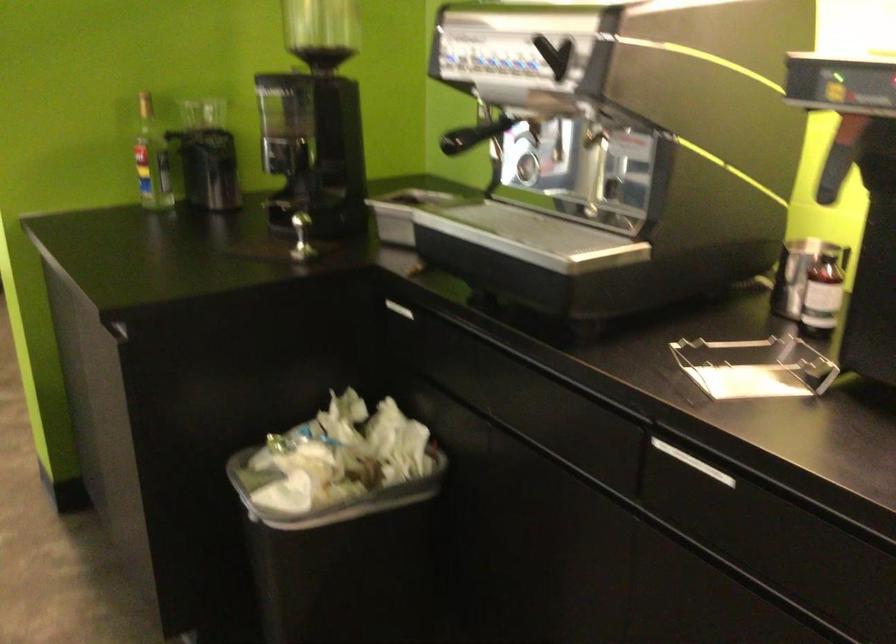
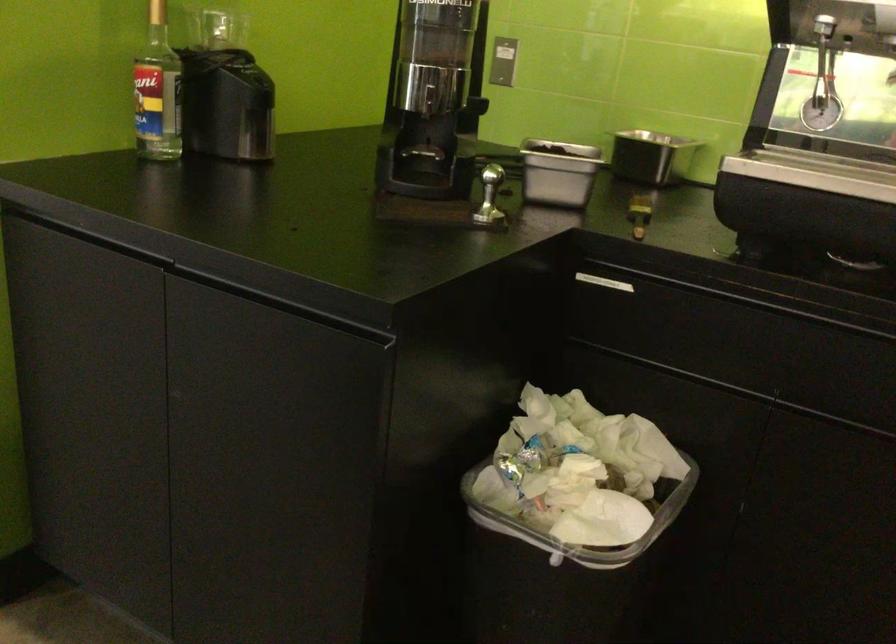
Where in the second image is the point corresponding to (x=143, y=162) from the first image?

(158, 91)